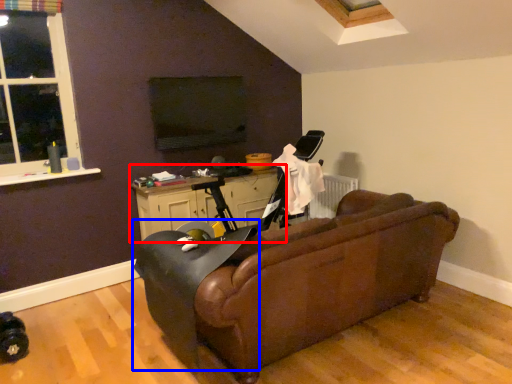
Question: Which object is closer to the camera taking this photo, table (highlighted by a red box) or swivel chair (highlighted by a blue box)?

Choices:
 (A) table
 (B) swivel chair

Answer: (B)